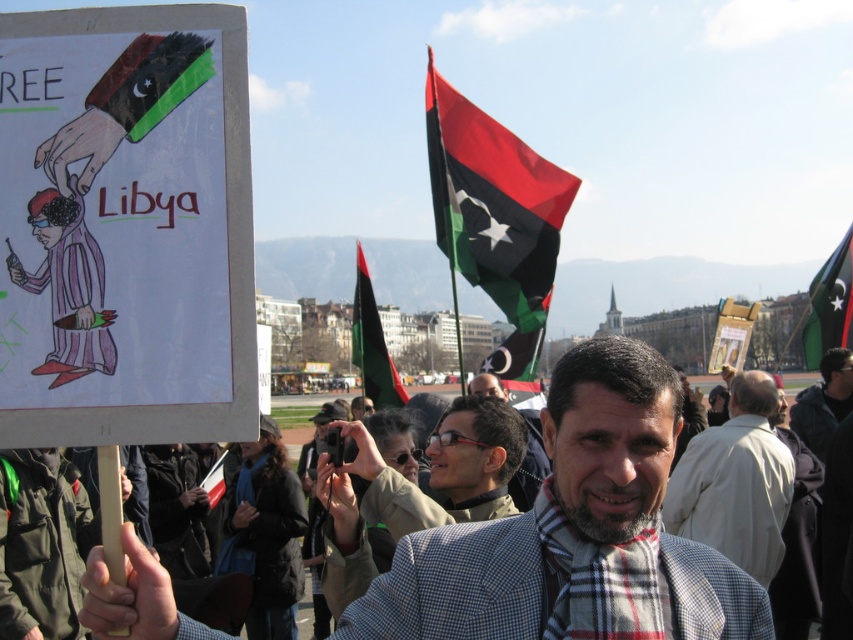
Question: Where is checkered wool scarf at center located in relation to plaid scarf at center in the image?

Choices:
 (A) left
 (B) right

Answer: (B)

Question: Is red fabric flag at upper center further to the viewer compared to black fabric flag at upper right?

Choices:
 (A) no
 (B) yes

Answer: (A)

Question: Can you confirm if gray checkered suit at center is positioned to the left of black matte flag at center?

Choices:
 (A) no
 (B) yes

Answer: (A)

Question: Which of the following is the closest to the observer?

Choices:
 (A) dark gray jacket at center
 (B) black fabric flag at upper right
 (C) gray checkered suit at center

Answer: (C)

Question: Among these points, which one is nearest to the camera?

Choices:
 (A) (560, 408)
 (B) (714, 372)

Answer: (A)

Question: Estimate the real-world distances between objects in this image. Which object is farther from the matte black jacket at center?

Choices:
 (A) dark gray jacket at center
 (B) matte paper poster at center
 (C) plaid scarf at center
 (D) red fabric flag at upper center

Answer: (B)